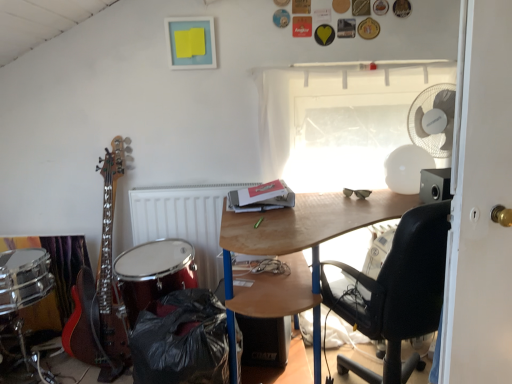
Measure the distance between point (x=234, y=195) and camera.

6.53 feet.

Where is `wooden desk at center`? This screenshot has height=384, width=512. wooden desk at center is located at coordinates (296, 253).

Consider the image. Measure the distance between point (264, 283) and camera.

The distance of point (264, 283) from camera is 1.68 meters.

You are a GUI agent. You are given a task and a screenshot of the screen. Output one action in this format:
    pyautogui.click(x=<x>, y=<y>)
    Task: Click on the white painted wood door at right
    
    Given the screenshot: What is the action you would take?
    pyautogui.click(x=480, y=202)

What do you see at coordinates (480, 202) in the screenshot? I see `white painted wood door at right` at bounding box center [480, 202].

What do you see at coordinates (357, 193) in the screenshot?
I see `satin black sunglasses at upper center` at bounding box center [357, 193].

The image size is (512, 384). What do you see at coordinates (181, 340) in the screenshot?
I see `black plastic trash can at lower left` at bounding box center [181, 340].

Describe the element at coordinates (154, 273) in the screenshot. I see `shiny red drum at lower left` at that location.

This screenshot has width=512, height=384. What are the coordinates of `white matte radiator at center` in the screenshot? It's located at (184, 221).

The image size is (512, 384). I want to click on hardcover book at center, so click(x=281, y=198).

Is the depth of hardcover book at center less than that of transparent plastic window at upper center?

That is True.

The height and width of the screenshot is (384, 512). In the image, there is a transparent plastic window at upper center. Find the location of `book below it (from a real-world perspective)`. book below it (from a real-world perspective) is located at coordinates (281, 198).

Is hardcover book at center oriented away from transparent plastic window at upper center?

That's not correct — hardcover book at center is not looking away from transparent plastic window at upper center.

Is shiny red drum at lower left in front of hardcover book at center?

Yes, shiny red drum at lower left is in front of hardcover book at center.

Is point (166, 239) positioned after point (271, 203)?

Yes, it is.

Is shiny red drum at lower left surrounding hardcover book at center?

No, hardcover book at center is not a part of shiny red drum at lower left.

From a real-world perspective, does shiny red drum at lower left stand above hardcover book at center?

Incorrect, from a real-world perspective, shiny red drum at lower left is lower than hardcover book at center.

Between black plastic trash can at lower left and shiny red drum at lower left, which one appears on the left side from the viewer's perspective?

shiny red drum at lower left is more to the left.

Does point (204, 336) lie behind point (175, 277)?

No.

Is black plastic trash can at lower left far away from shiny red drum at lower left?

No, black plastic trash can at lower left is in close proximity to shiny red drum at lower left.

Is black plastic trash can at lower left wider than shiny red drum at lower left?

Yes, black plastic trash can at lower left is wider than shiny red drum at lower left.

From the image's perspective, who appears lower, white painted wood door at right or satin black sunglasses at upper center?

white painted wood door at right is shown below in the image.

Is white painted wood door at right not inside satin black sunglasses at upper center?

Yes.

Does white painted wood door at right have a greater height compared to satin black sunglasses at upper center?

Indeed, white painted wood door at right has a greater height compared to satin black sunglasses at upper center.

Is black plastic trash can at lower left oriented away from wooden desk at center?

No, black plastic trash can at lower left is not facing away from wooden desk at center.

From a real-world perspective, is black plastic trash can at lower left over wooden desk at center?

No, from a real-world perspective, black plastic trash can at lower left is not above wooden desk at center.

From the image's perspective, which object appears higher, black plastic trash can at lower left or wooden desk at center?

From the image's view, wooden desk at center is above.

In the scene shown: From a real-world perspective, who is located lower, wooden desk at center or black matte speaker at lower center?

black matte speaker at lower center, from a real-world perspective.

In the scene shown: Which of these two, wooden desk at center or black matte speaker at lower center, is smaller?

black matte speaker at lower center is smaller.

Would you say wooden desk at center is to the left or to the right of black matte speaker at lower center in the picture?

wooden desk at center is positioned on black matte speaker at lower center's right side.

Looking at this image, considering the sizes of objects black plastic trash can at lower left and satin black sunglasses at upper center in the image provided, who is shorter, black plastic trash can at lower left or satin black sunglasses at upper center?

With less height is satin black sunglasses at upper center.

Which is in front, point (153, 311) or point (368, 193)?

Point (153, 311)

Would you consider black plastic trash can at lower left to be distant from satin black sunglasses at upper center?

No, black plastic trash can at lower left is not far from satin black sunglasses at upper center.

The image size is (512, 384). Identify the location of book that appears below the transparent plastic window at upper center (from a real-world perspective). (281, 198).

Image resolution: width=512 pixels, height=384 pixels. I want to click on drum in front of the hardcover book at center, so click(x=154, y=273).

Based on their spatial positions, is white painted wood door at right or transparent plastic window at upper center closer to white plastic mechanical fan at upper right?

Based on the image, transparent plastic window at upper center appears to be nearer to white plastic mechanical fan at upper right.

In the scene shown: When comparing their distances from black plastic trash can at lower left, does white plastic mechanical fan at upper right or hardcover book at center seem further?

white plastic mechanical fan at upper right is further to black plastic trash can at lower left.

Based on their spatial positions, is satin black sunglasses at upper center or hardcover book at center further from black plastic trash can at lower left?

satin black sunglasses at upper center is positioned further to the anchor black plastic trash can at lower left.

When comparing their distances from white painted wood door at right, does transparent plastic window at upper center or white matte radiator at center seem further?

white matte radiator at center is positioned further to the anchor white painted wood door at right.

When comparing their distances from satin black sunglasses at upper center, does white plastic mechanical fan at upper right or black plastic trash can at lower left seem closer?

white plastic mechanical fan at upper right lies closer to satin black sunglasses at upper center than the other object.

Estimate the real-world distances between objects in this image. Which object is further from satin black sunglasses at upper center, black plastic trash can at lower left or transparent plastic window at upper center?

black plastic trash can at lower left is further to satin black sunglasses at upper center.

Based on their spatial positions, is black matte speaker at lower center or white plastic mechanical fan at upper right closer to white painted wood door at right?

The object closer to white painted wood door at right is white plastic mechanical fan at upper right.

Estimate the real-world distances between objects in this image. Which object is further from wooden desk at center, hardcover book at center or transparent plastic window at upper center?

transparent plastic window at upper center is positioned further to the anchor wooden desk at center.

At what (x,y) coordinates should I click in order to perform the action: click on book positioned between black plastic trash can at lower left and white matte radiator at center from near to far. Please return your answer as a coordinate pair (x, y). Image resolution: width=512 pixels, height=384 pixels. Looking at the image, I should click on (281, 198).

The image size is (512, 384). I want to click on mechanical fan between white painted wood door at right and white matte radiator at center along the z-axis, so [x=406, y=168].

The image size is (512, 384). In order to click on mechanical fan positioned between wooden desk at center and satin black sunglasses at upper center from near to far in this screenshot , I will do `click(406, 168)`.

The image size is (512, 384). Identify the location of glasses between shiny red drum at lower left and transparent plastic window at upper center from left to right. (357, 193).